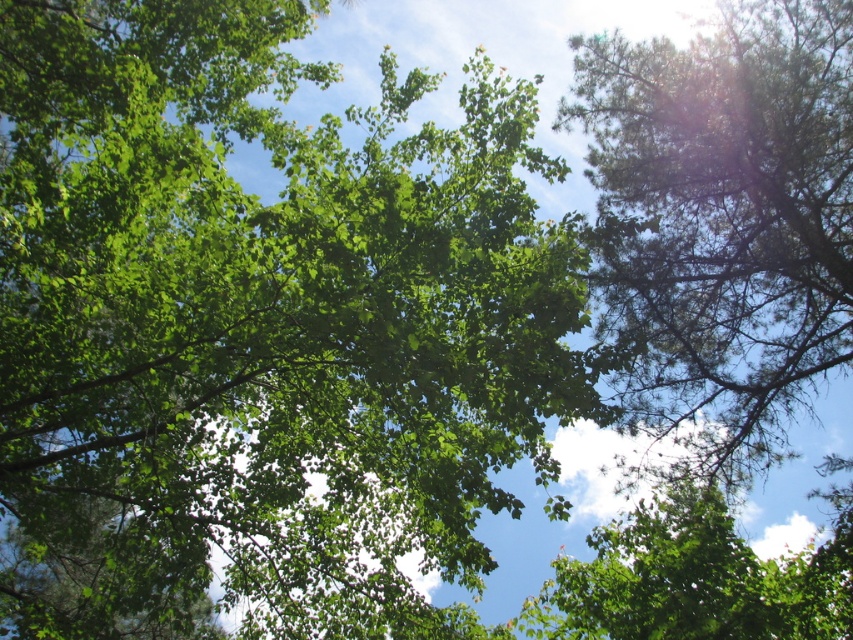
Which of these two, green leafy tree at center or green leafy tree at upper center, stands taller?

green leafy tree at center is taller.

Is green leafy tree at center smaller than green leafy tree at upper center?

No.

The image size is (853, 640). Find the location of `green leafy tree at center`. green leafy tree at center is located at coordinates pyautogui.click(x=259, y=330).

You are a GUI agent. You are given a task and a screenshot of the screen. Output one action in this format:
    pyautogui.click(x=<x>, y=<y>)
    Task: Click on the green leafy tree at center
    
    Given the screenshot: What is the action you would take?
    pyautogui.click(x=259, y=330)

Can you confirm if green needle-like at right is taller than green leafy tree at upper center?

No, green needle-like at right is not taller than green leafy tree at upper center.

Image resolution: width=853 pixels, height=640 pixels. Describe the element at coordinates (723, 220) in the screenshot. I see `green needle-like at right` at that location.

The image size is (853, 640). Describe the element at coordinates (723, 220) in the screenshot. I see `green needle-like at right` at that location.

Locate an element on the screen. Image resolution: width=853 pixels, height=640 pixels. green needle-like at right is located at coordinates (723, 220).

Does green leafy tree at center have a greater width compared to green needle-like at right?

Yes.

Which is below, green leafy tree at center or green needle-like at right?

green needle-like at right is lower down.

Locate an element on the screen. This screenshot has height=640, width=853. green leafy tree at center is located at coordinates (259, 330).